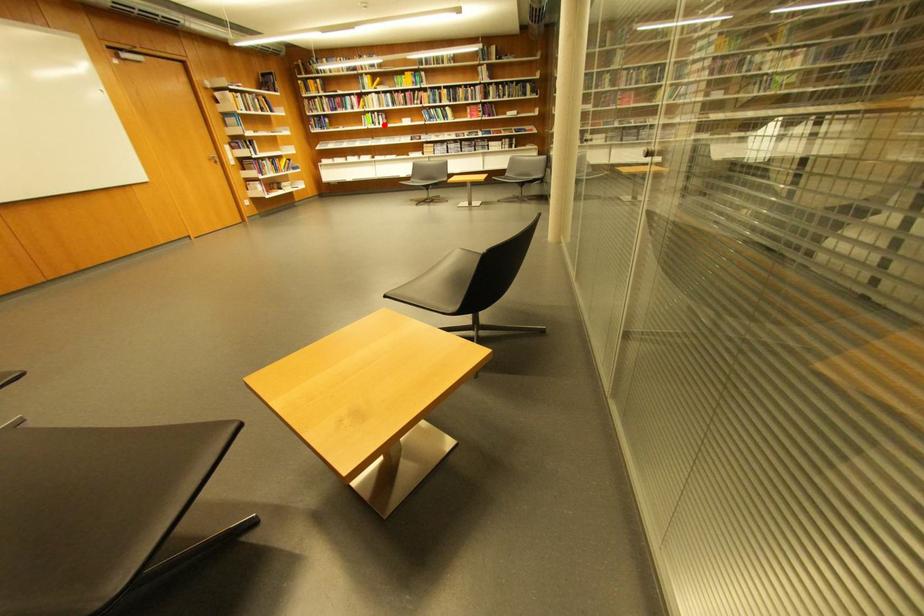
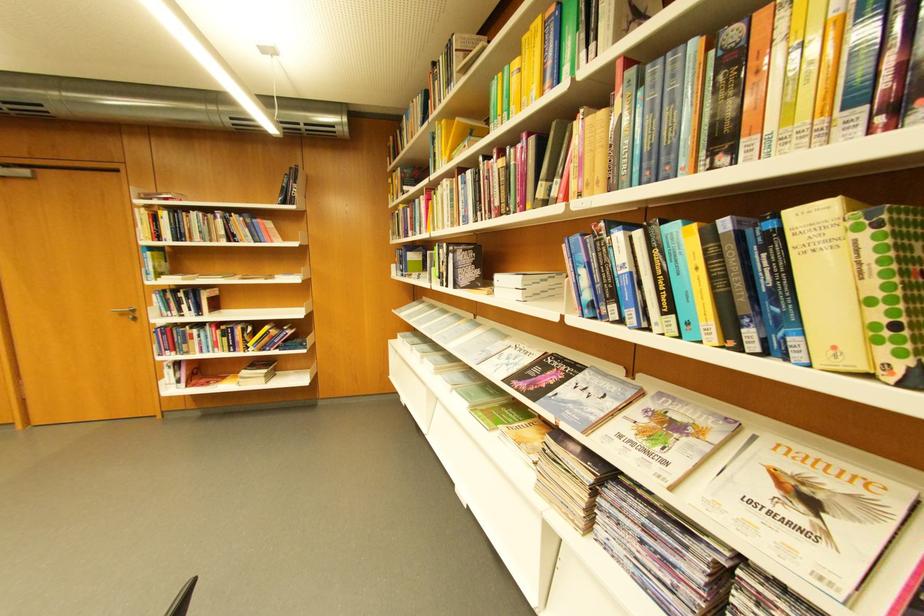
Question: I am providing you with two images of the same scene from different viewpoints. Given a red point in image1, look at the same physical point in image2. Is it:

Choices:
 (A) Closer to the viewpoint
 (B) Farther from the viewpoint

Answer: (B)